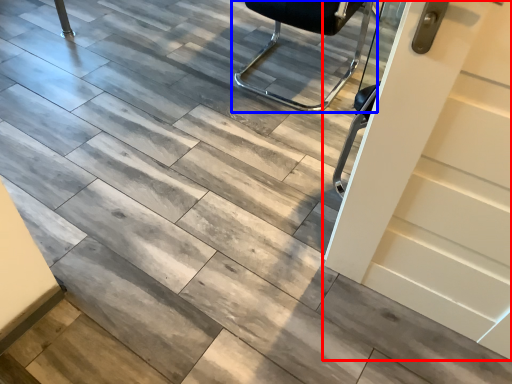
Question: Which point is closer to the camera, door (highlighted by a red box) or chair (highlighted by a blue box)?

Choices:
 (A) door
 (B) chair

Answer: (A)